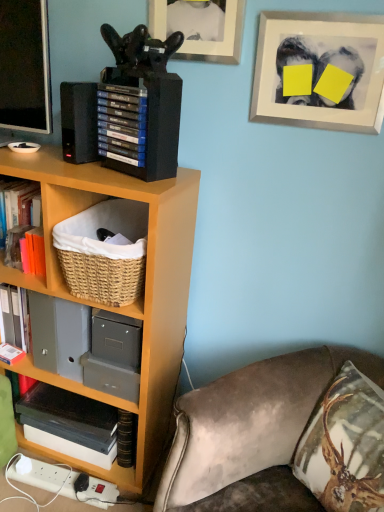
Find the location of a particular element. The width and height of the screenshot is (384, 512). free space to the left of blue matte game cases at upper left is located at coordinates (75, 167).